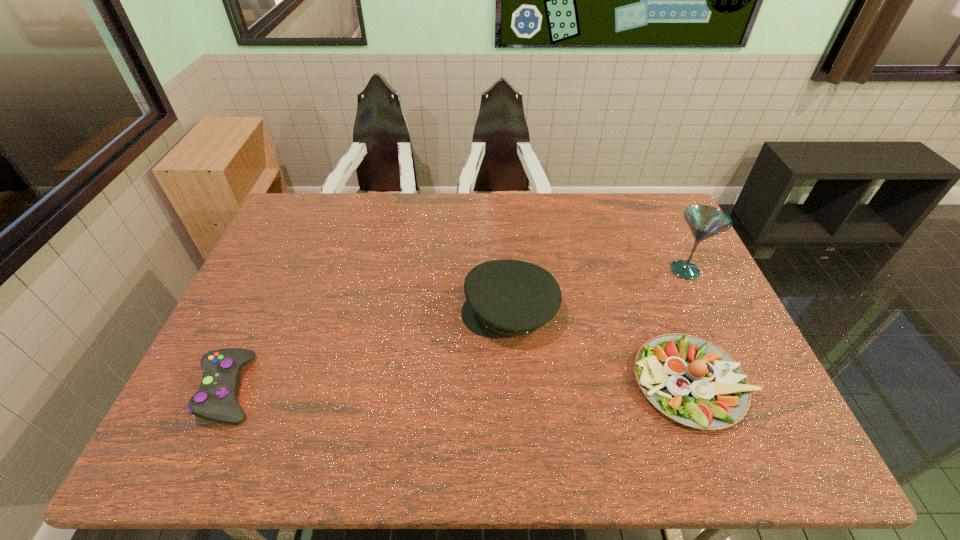
Find the location of a particular element. The height and width of the screenshot is (540, 960). the tallest object is located at coordinates (704, 221).

The image size is (960, 540). In order to click on beret in this screenshot , I will do `click(505, 298)`.

At what (x,y) coordinates should I click in order to perform the action: click on the second object from left to right. Please return your answer as a coordinate pair (x, y). The width and height of the screenshot is (960, 540). Looking at the image, I should click on (505, 298).

At what (x,y) coordinates should I click in order to perform the action: click on salad plate. Please return your answer as a coordinate pair (x, y). Looking at the image, I should click on (690, 380).

At what (x,y) coordinates should I click in order to perform the action: click on control. Please return your answer as a coordinate pair (x, y). The width and height of the screenshot is (960, 540). Looking at the image, I should click on (215, 400).

This screenshot has height=540, width=960. Find the location of `the shortest object`. the shortest object is located at coordinates (215, 400).

This screenshot has height=540, width=960. I want to click on free region located 0.250m on the back of the martini, so click(656, 209).

Identify the location of vacant space situated 0.350m on the front-facing side of the beret. (336, 313).

Locate an element on the screen. The height and width of the screenshot is (540, 960). vacant space situated on the front-facing side of the beret is located at coordinates (325, 313).

At what (x,y) coordinates should I click in order to perform the action: click on vacant area located 0.110m on the front-facing side of the beret. Please return your answer as a coordinate pair (x, y). This screenshot has height=540, width=960. Looking at the image, I should click on (421, 313).